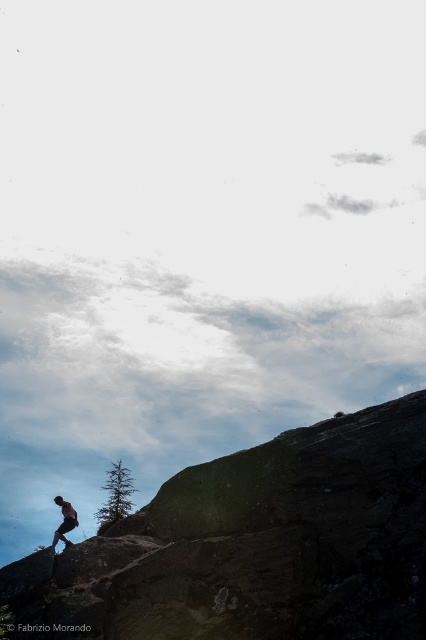
Question: Is rough textured rock at lower right closer to the viewer compared to dark brown leather pants at lower left?

Choices:
 (A) no
 (B) yes

Answer: (B)

Question: Can you confirm if rough textured rock at lower right is positioned below dark brown leather pants at lower left?

Choices:
 (A) no
 (B) yes

Answer: (A)

Question: Which object is farther from the camera taking this photo?

Choices:
 (A) dark brown leather pants at lower left
 (B) rough textured rock at lower right

Answer: (A)

Question: Which object appears farthest from the camera in this image?

Choices:
 (A) dark brown leather pants at lower left
 (B) rough textured rock at lower right

Answer: (A)

Question: Can you confirm if rough textured rock at lower right is thinner than dark brown leather pants at lower left?

Choices:
 (A) yes
 (B) no

Answer: (B)

Question: Which of the following is the farthest from the observer?

Choices:
 (A) (65, 536)
 (B) (39, 637)

Answer: (A)